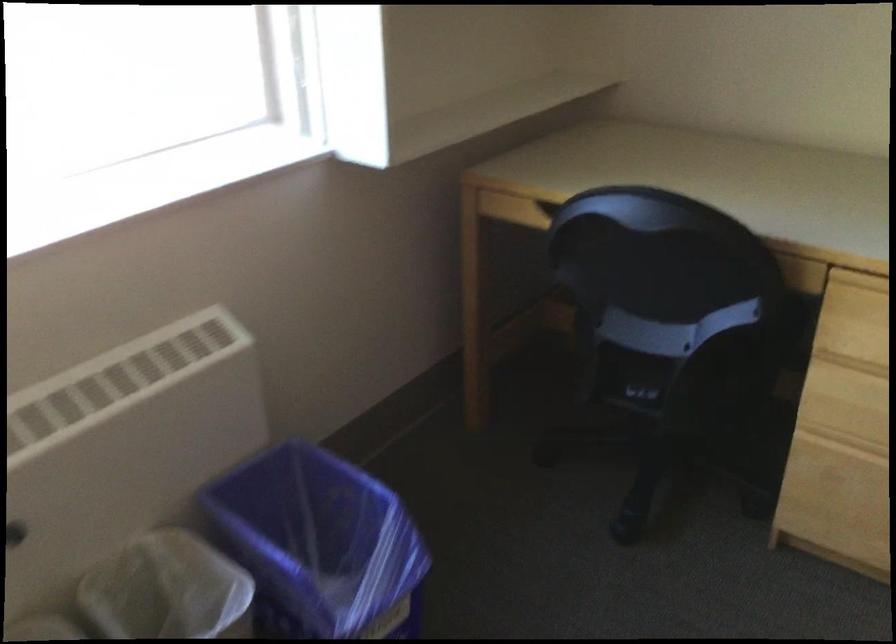
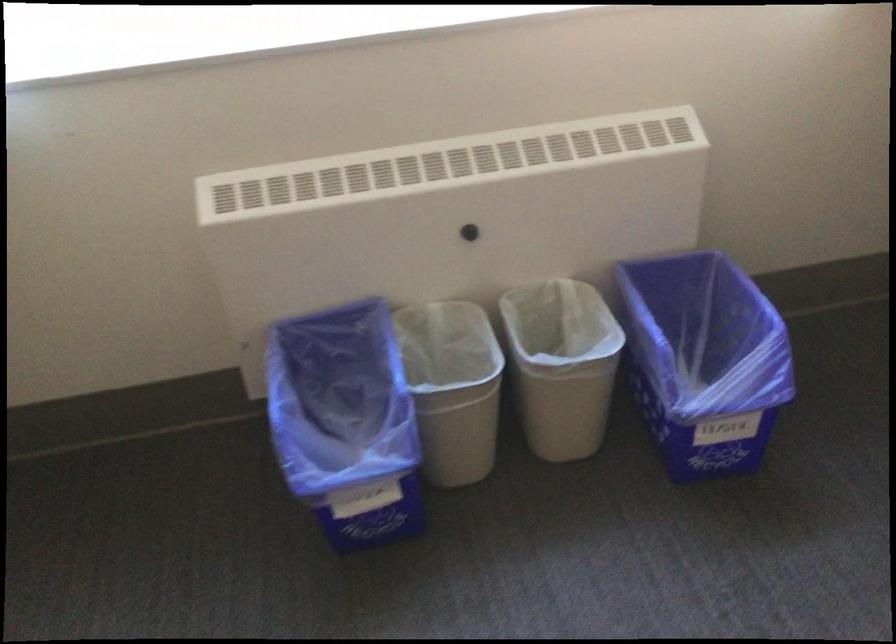
Question: The camera is either moving clockwise (left) or counter-clockwise (right) around the object. The first image is from the beginning of the video and the second image is from the end. Is the camera moving left or right when shooting the video?

Choices:
 (A) Left
 (B) Right

Answer: (B)